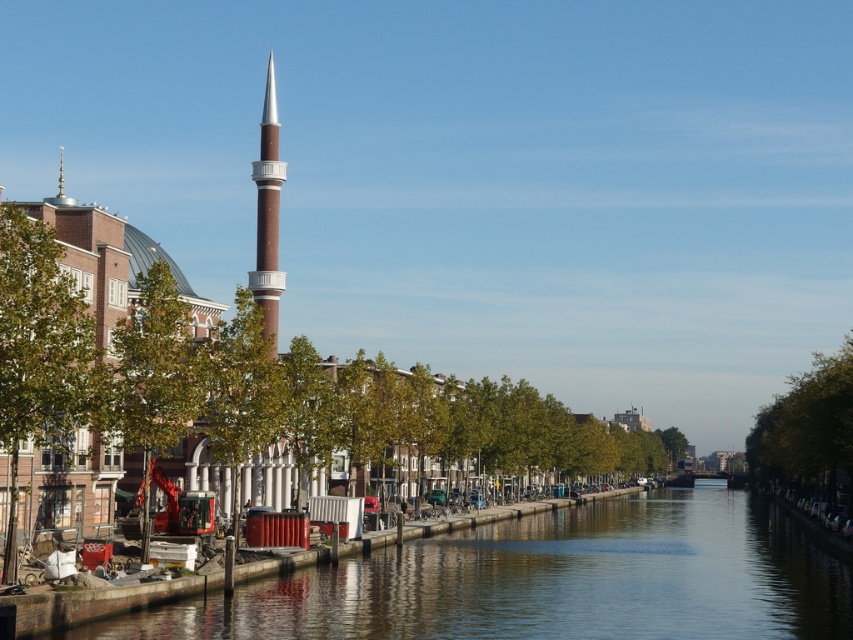
Question: Can you confirm if smooth concrete canal at lower left is positioned to the left of brown glossy minaret at center?

Choices:
 (A) no
 (B) yes

Answer: (A)

Question: Among these objects, which one is nearest to the camera?

Choices:
 (A) smooth concrete canal at lower left
 (B) brown glossy minaret at center

Answer: (A)

Question: Can you confirm if smooth concrete canal at lower left is bigger than brown glossy minaret at center?

Choices:
 (A) yes
 (B) no

Answer: (B)

Question: Which of the following is the closest to the observer?

Choices:
 (A) brown glossy minaret at center
 (B) smooth concrete canal at lower left

Answer: (B)

Question: Can you confirm if smooth concrete canal at lower left is positioned to the right of brown glossy minaret at center?

Choices:
 (A) yes
 (B) no

Answer: (A)